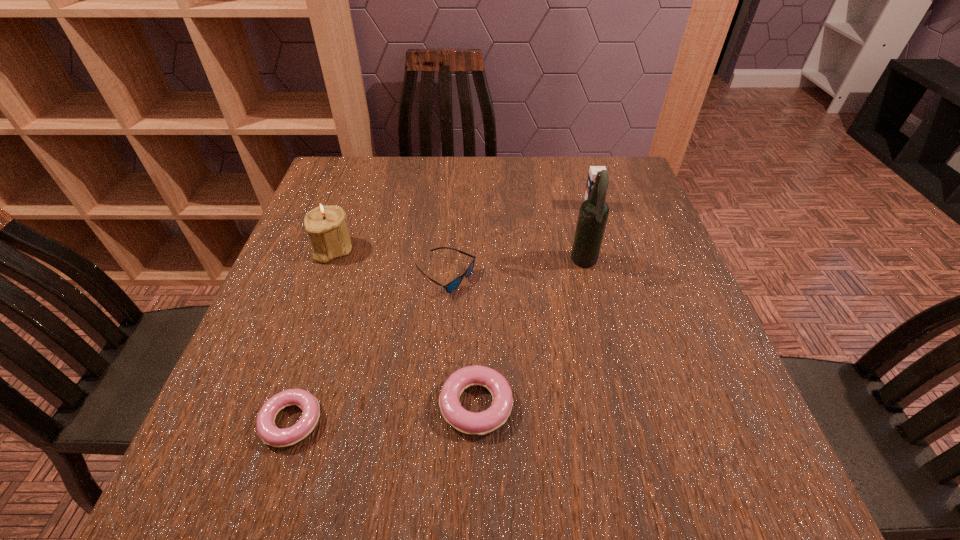
I want to click on vacant area situated on the right of the candle_holder, so click(x=489, y=248).

Identify the location of vacant space situated 0.340m on the front label of the third tallest object. (622, 309).

Where is `free space located on the front of the tallest object`? The width and height of the screenshot is (960, 540). free space located on the front of the tallest object is located at coordinates (609, 359).

The width and height of the screenshot is (960, 540). Identify the location of vacant space located at the front of the sunglasses showing the lenses. (620, 276).

You are a GUI agent. You are given a task and a screenshot of the screen. Output one action in this format:
    pyautogui.click(x=<x>, y=<y>)
    Task: Click on the object located at the far edge
    
    Given the screenshot: What is the action you would take?
    (x=593, y=170)

Find the location of a particular element. The image size is (960, 540). doughnut that is at the left edge is located at coordinates (270, 434).

Find the location of `candle_holder at the left edge`. candle_holder at the left edge is located at coordinates [x=326, y=225].

This screenshot has height=540, width=960. What are the coordinates of `object situated at the right edge` in the screenshot? It's located at (593, 170).

You are a GUI agent. You are given a task and a screenshot of the screen. Output one action in this format:
    pyautogui.click(x=<x>, y=<y>)
    Task: Click on the object present at the near left corner
    The image size is (960, 540).
    Given the screenshot: What is the action you would take?
    pyautogui.click(x=270, y=434)

Locate an element on the screen. The height and width of the screenshot is (540, 960). object situated at the far right corner is located at coordinates (593, 170).